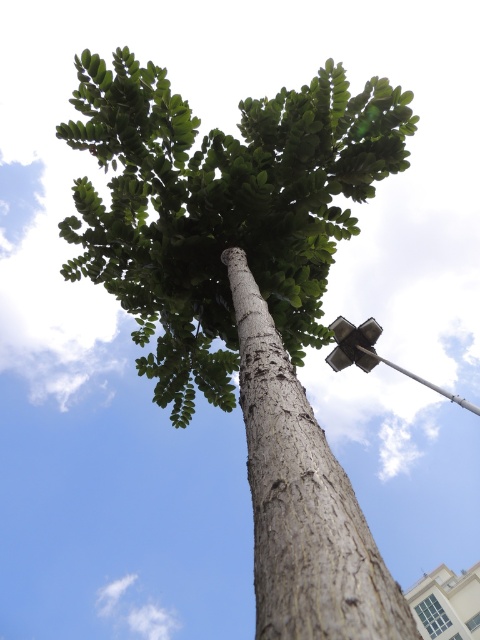
Question: Can you confirm if gray textured tree trunk at center is thinner than metallic silver streetlight at upper right?

Choices:
 (A) no
 (B) yes

Answer: (B)

Question: Which is nearer to the gray textured tree trunk at center?

Choices:
 (A) green rough bark tree at center
 (B) metallic silver streetlight at upper right

Answer: (A)

Question: Estimate the real-world distances between objects in this image. Which object is farther from the gray textured tree trunk at center?

Choices:
 (A) metallic silver streetlight at upper right
 (B) green rough bark tree at center

Answer: (A)

Question: Which object is the farthest from the metallic silver streetlight at upper right?

Choices:
 (A) gray textured tree trunk at center
 (B) green rough bark tree at center

Answer: (A)

Question: Is gray textured tree trunk at center in front of metallic silver streetlight at upper right?

Choices:
 (A) no
 (B) yes

Answer: (B)

Question: Is the position of green rough bark tree at center less distant than that of gray textured tree trunk at center?

Choices:
 (A) no
 (B) yes

Answer: (A)